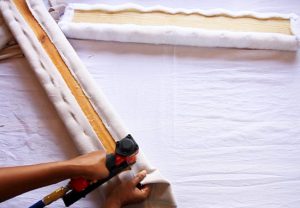
You are a GUI agent. You are given a task and a screenshot of the screen. Output one action in this format:
    pyautogui.click(x=<x>, y=<y>)
    Task: Click on the cord
    
    Given the screenshot: What is the action you would take?
    pyautogui.click(x=38, y=205)